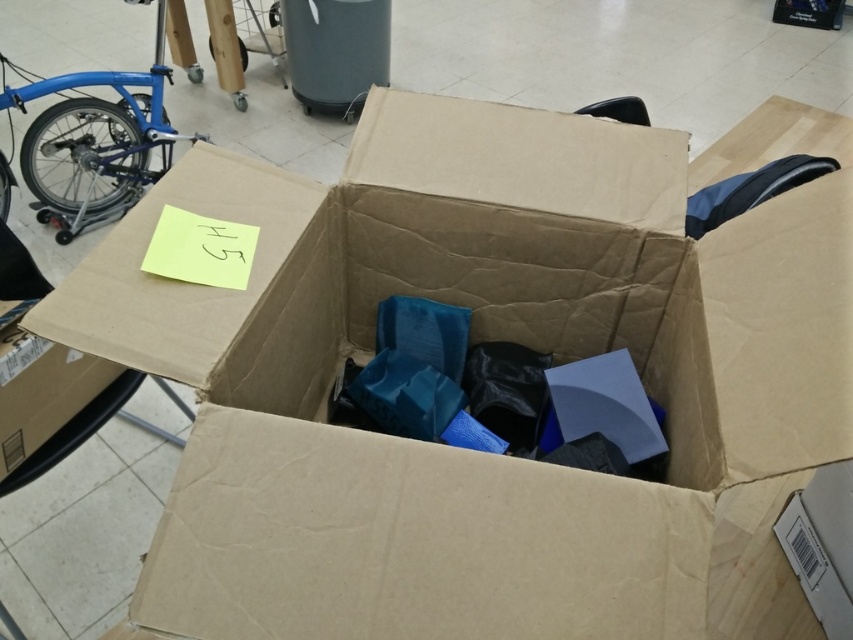
Question: Which point appears farthest from the camera in this image?

Choices:
 (A) 148,124
 (B) 48,368

Answer: (A)

Question: Is matte blue bicycle at left to the right of brown cardboard box at lower left from the viewer's perspective?

Choices:
 (A) yes
 (B) no

Answer: (B)

Question: Is matte blue bicycle at left to the right of brown cardboard box at lower left from the viewer's perspective?

Choices:
 (A) no
 (B) yes

Answer: (A)

Question: Does matte blue bicycle at left appear over brown cardboard box at lower left?

Choices:
 (A) no
 (B) yes

Answer: (B)

Question: Which object appears closest to the camera in this image?

Choices:
 (A) brown cardboard box at lower left
 (B) matte blue bicycle at left

Answer: (A)